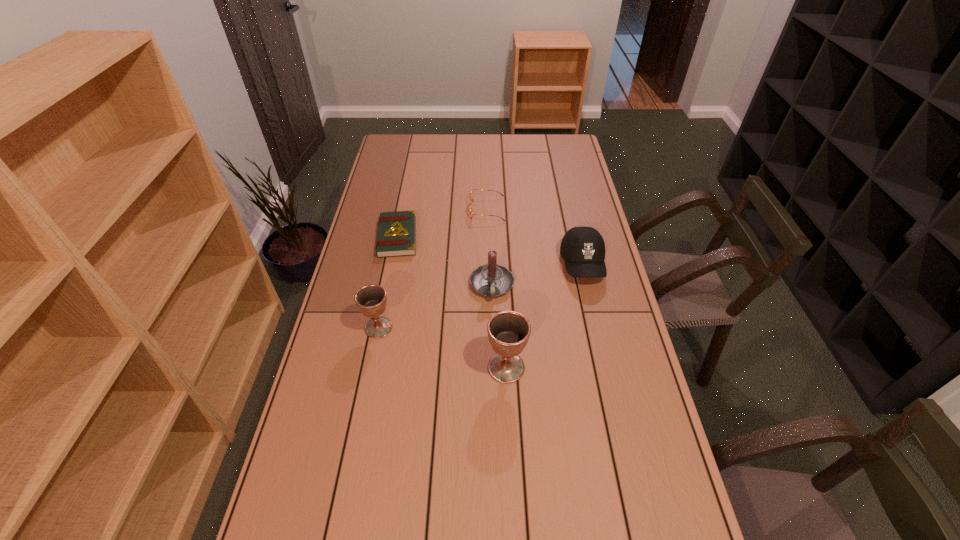
Considering the uniform spacing of chalices, where should an additional chalice be positioned on the right? Please locate a free spot. Please provide its 2D coordinates. Your answer should be formatted as a tuple, i.e. [(x, y)], where the tuple contains the x and y coordinates of a point satisfying the conditions above.

[(655, 414)]